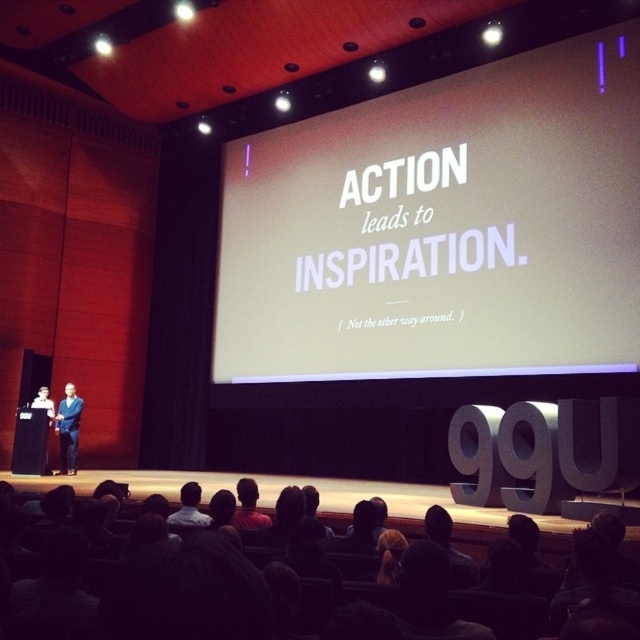
You are a photographer who needs to adjust the focus of your camera to capture a clear image of the dark hair at center. Given that the camera has a minimum focusing distance of 2.5 meters, will you need to move closer or farther away?

The dark hair at center and camera are 2.65 meters apart. Since the minimum focusing distance is 2.5 meters, the photographer must move closer to the dark hair at center to ensure the camera can focus properly.

Consider the image. You are an event planner setting up a new projector for the presentation. The projector is placed at the back of the auditorium. You need to ensure that the projected image will be centered on the white matte screen at center. Given that the screen is located at point (442, 227), can you confirm if the projector is aligned correctly?

The point (442, 227) marks the white matte screen at center, so the projector at the back should be aligned towards this coordinate to ensure the projected image is centered on the white matte screen at center.

You are a photographer in the audience and want to capture a closeup of the dark hair at center. Which direction should you move your camera to focus on it?

The dark hair at center is located at point 0.795 on the x axis and 0.622 on the y axis, so you should move your camera to the right and up to focus on it.